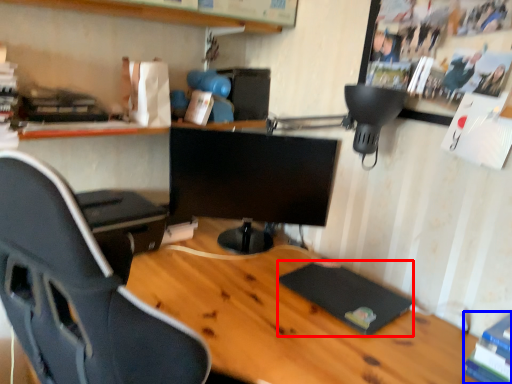
Question: Which object is further to the camera taking this photo, pad (highlighted by a red box) or book (highlighted by a blue box)?

Choices:
 (A) pad
 (B) book

Answer: (A)